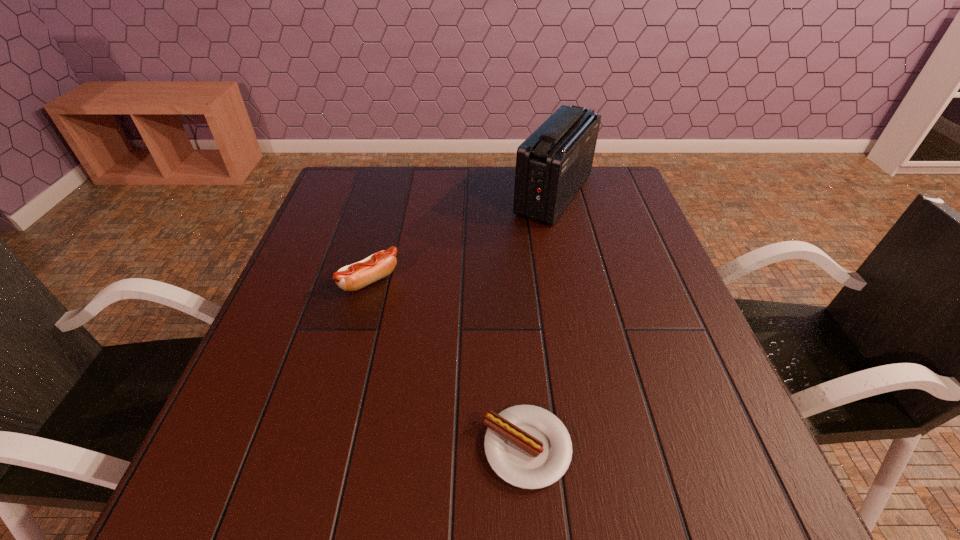
Where is `vacant area that lies between the farther sausage and the right sausage`? vacant area that lies between the farther sausage and the right sausage is located at coordinates (448, 364).

Identify the location of free space between the second shortest object and the nearer sausage. The image size is (960, 540). (448, 364).

I want to click on object that is the nearest to the taller sausage, so click(552, 164).

Locate an element on the screen. The height and width of the screenshot is (540, 960). object that can be found as the closest to the nearest object is located at coordinates (353, 277).

At what (x,y) coordinates should I click in order to perform the action: click on free space that satisfies the following two spatial constraints: 1. on the front panel of the farthest object; 2. on the front side of the farther sausage. Please return your answer as a coordinate pair (x, y). Image resolution: width=960 pixels, height=540 pixels. Looking at the image, I should click on (573, 281).

Locate an element on the screen. free spot that satisfies the following two spatial constraints: 1. on the front panel of the farthest object; 2. on the front side of the taller sausage is located at coordinates (573, 281).